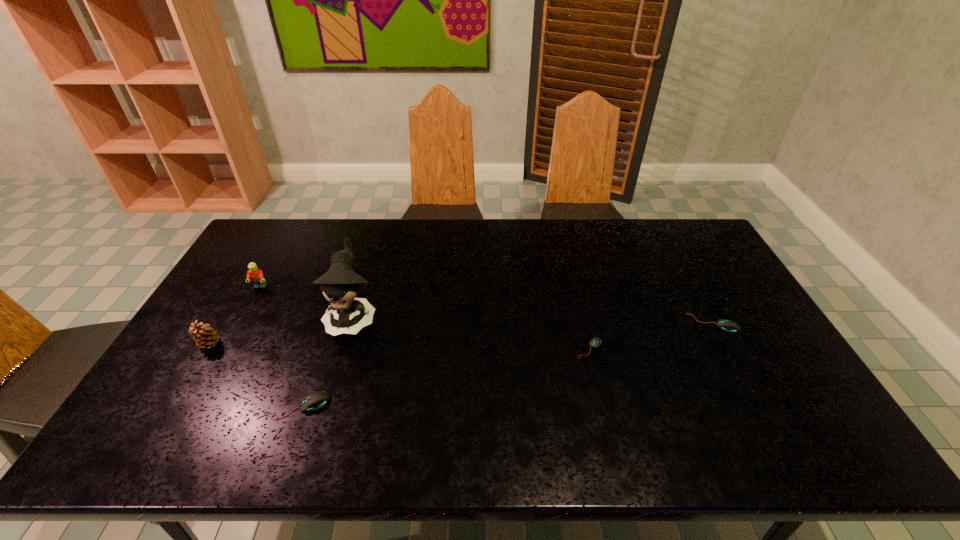
Please determine a free point for an extra mouse_(computer_equipment) to ensure balance. Please provide its 2D coordinates. Your answer should be formatted as a tuple, i.e. [(x, y)], where the tuple contains the x and y coordinates of a point satisfying the conditions above.

[(451, 375)]